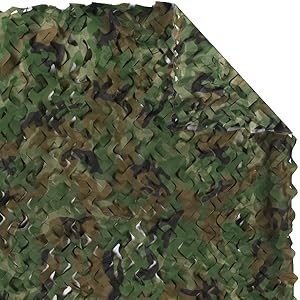
Find the location of a particular element. corner is located at coordinates (293, 297).